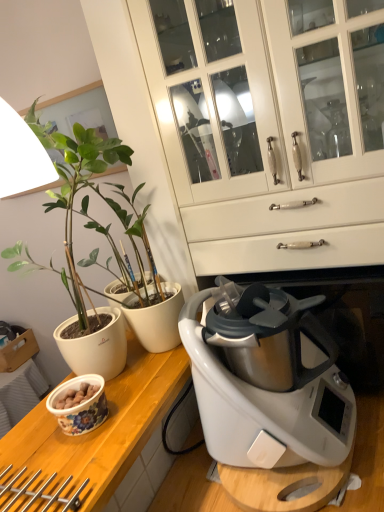
Describe the element at coordinates (103, 426) in the screenshot. I see `wooden at left` at that location.

The image size is (384, 512). What do you see at coordinates (270, 129) in the screenshot?
I see `white glossy cabinet at center` at bounding box center [270, 129].

Find the location of a particular element. floral ceramic bowl at lower left is located at coordinates (102, 426).

Is white glossy cabinet at center directly adjacent to floral ceramic bowl at lower left?

No, white glossy cabinet at center is not beside floral ceramic bowl at lower left.

Where is `counter top that appears below the white glossy cabinet at center (from the image's perspective)`? Image resolution: width=384 pixels, height=512 pixels. counter top that appears below the white glossy cabinet at center (from the image's perspective) is located at coordinates (102, 426).

Could you tell me if white glossy cabinet at center is turned towards floral ceramic bowl at lower left?

Yes.

Considering the sizes of objects white glossy cabinet at center and floral ceramic bowl at lower left in the image provided, who is taller, white glossy cabinet at center or floral ceramic bowl at lower left?

white glossy cabinet at center.

Identify the location of countertop below the matte white pot at left (from the image's perspective). The width and height of the screenshot is (384, 512). (103, 426).

Is matte white pot at left at the right side of wooden at left?

No.

Looking at their sizes, would you say matte white pot at left is wider or thinner than wooden at left?

matte white pot at left is thinner than wooden at left.

Could you tell me if matte white pot at left is turned towards wooden at left?

Yes.

Considering the positions of objects white glossy cabinet at center and wooden at left in the image provided, who is behind, white glossy cabinet at center or wooden at left?

white glossy cabinet at center is further away from the camera.

Is white glossy cabinet at center turned away from wooden at left?

white glossy cabinet at center does not have its back to wooden at left.

Are white glossy cabinet at center and wooden at left beside each other?

white glossy cabinet at center and wooden at left are clearly separated.

In the scene shown: Is wooden at left wider than white glossy cabinet at center?

Indeed, wooden at left has a greater width compared to white glossy cabinet at center.

Is wooden at left positioned with its back to white glossy cabinet at center?

wooden at left is not turned away from white glossy cabinet at center.

Is wooden at left inside or outside of white glossy cabinet at center?

wooden at left is spatially situated outside white glossy cabinet at center.

From the image's perspective, does wooden at left appear lower than white glossy cabinet at center?

Yes, from the image's perspective, wooden at left is below white glossy cabinet at center.

Is wooden at left far away from floral ceramic bowl at lower left?

They are positioned close to each other.

Considering the positions of points (115, 470) and (39, 426), is point (115, 470) closer to camera compared to point (39, 426)?

Yes, point (115, 470) is in front of point (39, 426).

Would you say wooden at left contains floral ceramic bowl at lower left?

No.

From a real-world perspective, relative to floral ceramic bowl at lower left, is wooden at left vertically above or below?

From a real-world perspective, wooden at left is physically above floral ceramic bowl at lower left.

Considering the relative sizes of white glossy cabinet at center and matte white pot at left in the image provided, is white glossy cabinet at center bigger than matte white pot at left?

Yes, white glossy cabinet at center is bigger than matte white pot at left.

Measure the distance from white glossy cabinet at center to matte white pot at left.

white glossy cabinet at center is 23.26 inches away from matte white pot at left.

Can you confirm if white glossy cabinet at center is taller than matte white pot at left?

Correct, white glossy cabinet at center is much taller as matte white pot at left.

Can you tell me how much white glossy cabinet at center and matte white pot at left differ in facing direction?

The facing directions of white glossy cabinet at center and matte white pot at left are 90 degrees apart.

From the image's perspective, is matte white pot at left on top of floral ceramic bowl at lower left?

Yes, from the image's perspective, matte white pot at left is above floral ceramic bowl at lower left.

What's the angular difference between matte white pot at left and floral ceramic bowl at lower left's facing directions?

There is a 1.66-degree angle between the facing directions of matte white pot at left and floral ceramic bowl at lower left.

Is matte white pot at left not close to floral ceramic bowl at lower left?

No, matte white pot at left is not far away from floral ceramic bowl at lower left.

Is matte white pot at left located outside floral ceramic bowl at lower left?

matte white pot at left is positioned outside floral ceramic bowl at lower left.

Locate an element on the screen. Image resolution: width=384 pixels, height=512 pixels. cabinetry above the floral ceramic bowl at lower left (from the image's perspective) is located at coordinates (270, 129).

Locate an element on the screen. houseplant above the wooden at left (from a real-world perspective) is located at coordinates (37, 312).

Which object lies nearer to the anchor point white glossy cabinet at center, wooden at left or matte white pot at left?

Among the two, wooden at left is located nearer to white glossy cabinet at center.

Looking at the image, which one is located further to matte white pot at left, white glossy cabinet at center or floral ceramic bowl at lower left?

floral ceramic bowl at lower left is further to matte white pot at left.

Considering their positions, is white glossy cabinet at center positioned closer to floral ceramic bowl at lower left than wooden at left?

The object closer to floral ceramic bowl at lower left is wooden at left.

Which object lies nearer to the anchor point floral ceramic bowl at lower left, matte white pot at left or wooden at left?

wooden at left lies closer to floral ceramic bowl at lower left than the other object.

Looking at this image, from the image, which object appears to be farther from floral ceramic bowl at lower left, wooden at left or white glossy cabinet at center?

Based on the image, white glossy cabinet at center appears to be further to floral ceramic bowl at lower left.

From the picture: From the image, which object appears to be farther from wooden at left, matte white pot at left or white glossy cabinet at center?

Among the two, matte white pot at left is located further to wooden at left.

Considering their positions, is white glossy cabinet at center positioned closer to wooden at left than floral ceramic bowl at lower left?

floral ceramic bowl at lower left lies closer to wooden at left than the other object.

Consider the image. Looking at the image, which one is located further to wooden at left, white glossy cabinet at center or matte white pot at left?

matte white pot at left.

Locate an element on the screen. The width and height of the screenshot is (384, 512). countertop between white glossy cabinet at center and floral ceramic bowl at lower left vertically is located at coordinates (103, 426).

Locate an element on the screen. Image resolution: width=384 pixels, height=512 pixels. countertop between matte white pot at left and floral ceramic bowl at lower left in the vertical direction is located at coordinates (103, 426).

At what (x,y) coordinates should I click in order to perform the action: click on houseplant between white glossy cabinet at center and floral ceramic bowl at lower left from top to bottom. Please return your answer as a coordinate pair (x, y). The image size is (384, 512). Looking at the image, I should click on (37, 312).

Where is `houseplant between white glossy cabinet at center and wooden at left vertically`? This screenshot has width=384, height=512. houseplant between white glossy cabinet at center and wooden at left vertically is located at coordinates point(37,312).